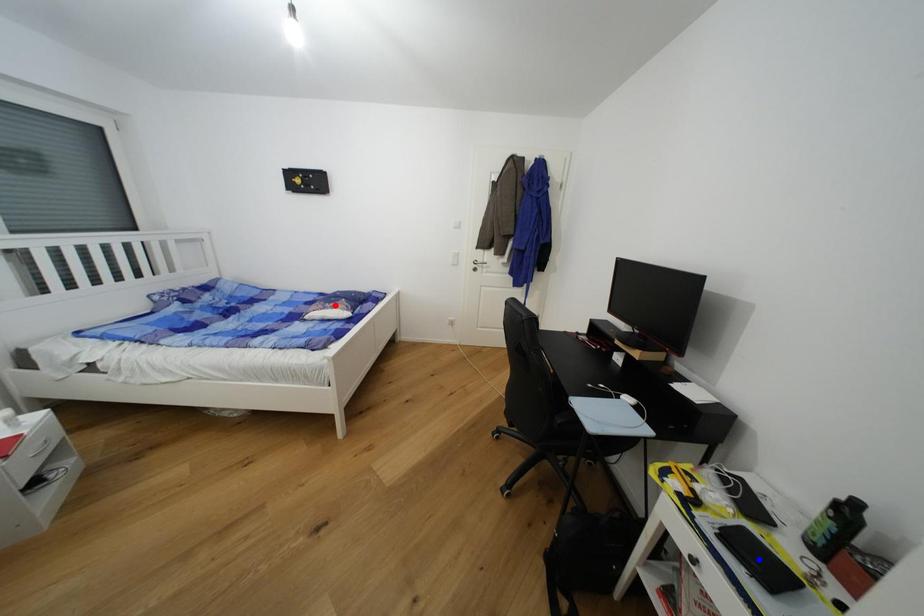
Question: In the image, two points are highlighted. Which point is nearer to the camera? Reply with the corresponding letter.

Choices:
 (A) blue point
 (B) red point

Answer: (A)